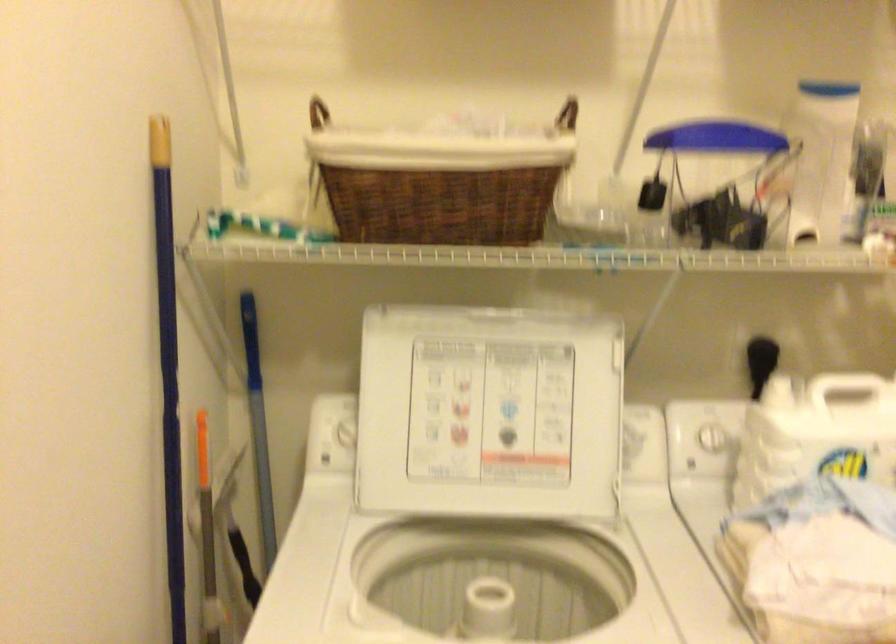
Find where to turn the white control knob. Please return your answer as a coordinate pair (x, y).

(698, 440)